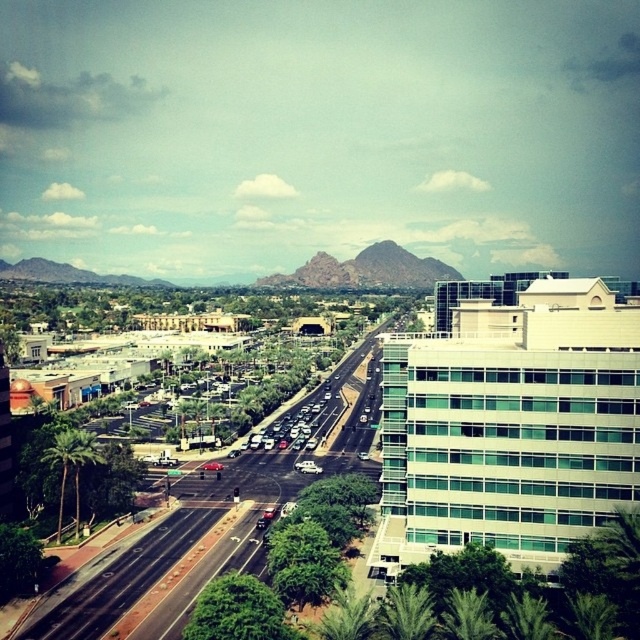
What are the coordinates of the rugged rock formation at center?

The rugged rock formation at center is located at coordinates point (365, 269).

Based on the photo, you are a drone operator trying to capture aerial footage of the urban landscape. You need to fly your drone from point A at point [426,637] to point B at point [454,588]. Considering the scene described, which point is closer to the camera and will appear larger in your footage?

Point [426,637] is closer to the camera than point [454,588], so it will appear larger in the footage.

You are a pedestrian standing at the crosswalk near the dark asphalt highway at center and the green leafy palm tree at lower left. Which object is closer to you as you face the scene?

The green leafy palm tree at lower left is closer to you since it is positioned above the dark asphalt highway at center, indicating it is nearer in the visual plane.